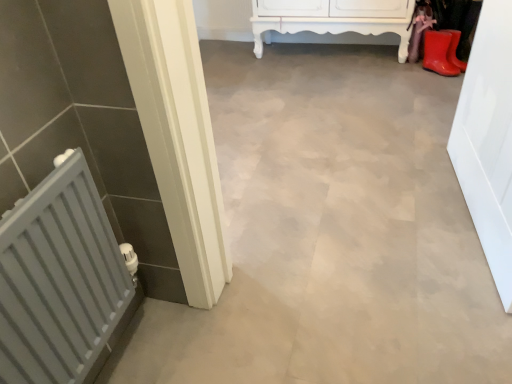
Question: Is white glossy door at right facing towards gray matte radiator at left?

Choices:
 (A) yes
 (B) no

Answer: (A)

Question: Does white glossy door at right have a greater width compared to gray matte radiator at left?

Choices:
 (A) no
 (B) yes

Answer: (A)

Question: Can you confirm if white glossy door at right is thinner than gray matte radiator at left?

Choices:
 (A) yes
 (B) no

Answer: (A)

Question: Does white glossy door at right lie in front of gray matte radiator at left?

Choices:
 (A) yes
 (B) no

Answer: (B)

Question: Is white glossy door at right surrounding gray matte radiator at left?

Choices:
 (A) no
 (B) yes

Answer: (A)

Question: Considering the positions of gray matte radiator at left and white glossy cabinet at upper center in the image, is gray matte radiator at left wider or thinner than white glossy cabinet at upper center?

Choices:
 (A) wide
 (B) thin

Answer: (B)

Question: From the image's perspective, is gray matte radiator at left above or below white glossy cabinet at upper center?

Choices:
 (A) above
 (B) below

Answer: (B)

Question: Would you say gray matte radiator at left is inside or outside white glossy cabinet at upper center?

Choices:
 (A) inside
 (B) outside

Answer: (B)

Question: Is point (88, 367) positioned closer to the camera than point (321, 8)?

Choices:
 (A) closer
 (B) farther

Answer: (A)

Question: Considering their positions, is gray matte radiator at left located in front of or behind white glossy door at right?

Choices:
 (A) behind
 (B) front

Answer: (B)

Question: From the image's perspective, is gray matte radiator at left above or below white glossy door at right?

Choices:
 (A) above
 (B) below

Answer: (B)

Question: In terms of width, does gray matte radiator at left look wider or thinner when compared to white glossy door at right?

Choices:
 (A) wide
 (B) thin

Answer: (A)

Question: From a real-world perspective, is gray matte radiator at left positioned above or below white glossy door at right?

Choices:
 (A) below
 (B) above

Answer: (B)

Question: Relative to white glossy cabinet at upper center, is rubber matte boot at upper right in front or behind?

Choices:
 (A) behind
 (B) front

Answer: (B)

Question: In terms of width, does rubber matte boot at upper right look wider or thinner when compared to white glossy cabinet at upper center?

Choices:
 (A) wide
 (B) thin

Answer: (B)